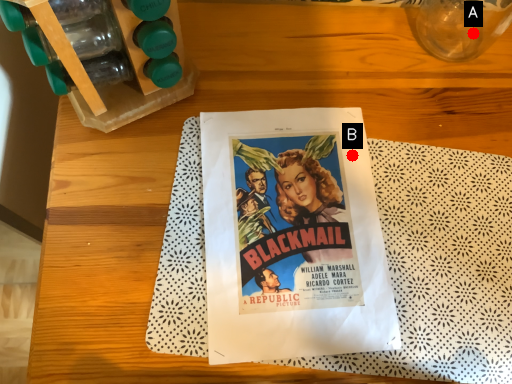
Question: Two points are circled on the image, labeled by A and B beside each circle. Which of the following is the farthest from the observer?

Choices:
 (A) A is further
 (B) B is further

Answer: (A)